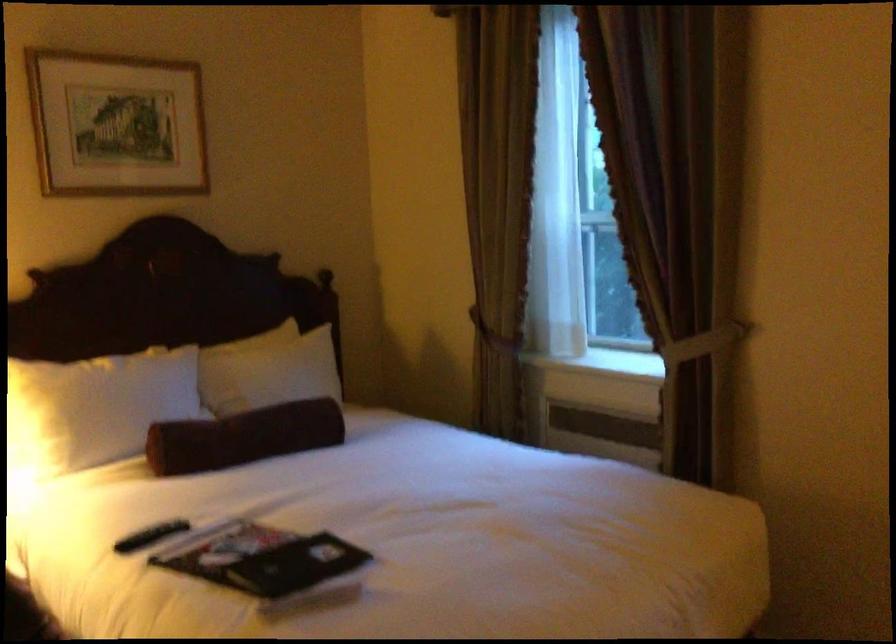
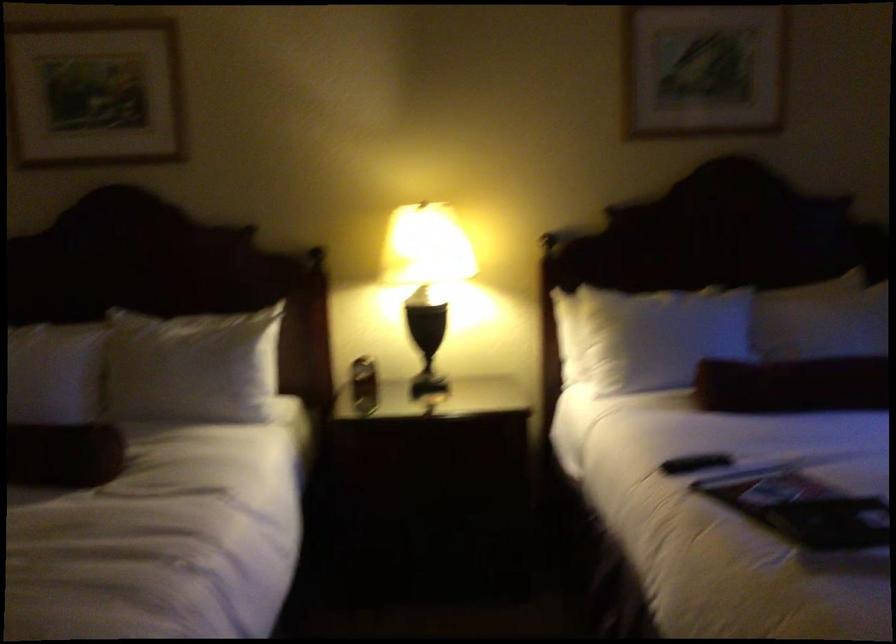
The point at (148, 536) is marked in the first image. Where is the corresponding point in the second image?

(695, 462)